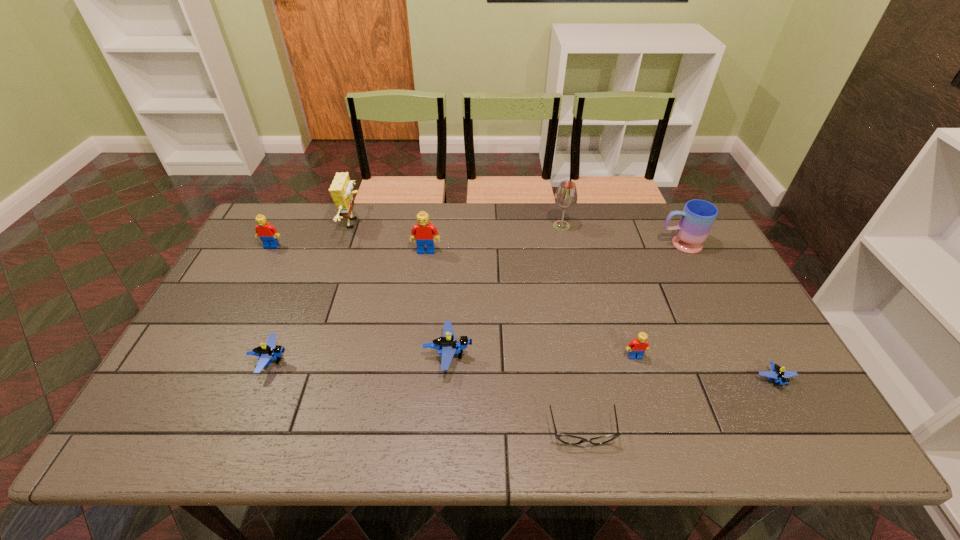
Find the location of a particular element. The height and width of the screenshot is (540, 960). free space at the left edge is located at coordinates (253, 310).

In the image, there is a desktop. Identify the location of blank space at the right edge. The image size is (960, 540). (746, 306).

Identify the location of vacant area that lies between the spectacles and the fifth Lego from left to right. The width and height of the screenshot is (960, 540). (609, 394).

Where is `empty location between the biggest blue Lego and the tallest Lego`? This screenshot has width=960, height=540. empty location between the biggest blue Lego and the tallest Lego is located at coordinates (438, 303).

Find the location of `free area in between the mug and the yellow sponge`. free area in between the mug and the yellow sponge is located at coordinates (516, 234).

Image resolution: width=960 pixels, height=540 pixels. Find the location of `vacant area between the fifth tallest object and the rightmost Lego`. vacant area between the fifth tallest object and the rightmost Lego is located at coordinates (523, 313).

Find the location of a particular element. This screenshot has height=540, width=960. free space that is in between the biggest blue Lego and the rightmost Lego is located at coordinates (612, 367).

Locate an element on the screen. This screenshot has width=960, height=540. vacant space in between the mug and the nearest object is located at coordinates (631, 338).

The width and height of the screenshot is (960, 540). Find the location of `free space between the leftmost object and the mug`. free space between the leftmost object and the mug is located at coordinates (475, 245).

This screenshot has width=960, height=540. Find the location of `free spot between the second blue Lego from left to right and the second red Lego from right to left`. free spot between the second blue Lego from left to right and the second red Lego from right to left is located at coordinates (438, 303).